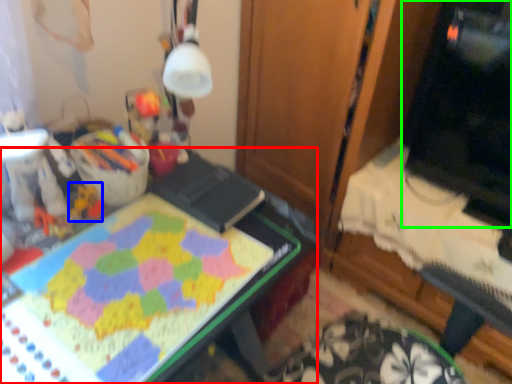
Question: Considering the real-world distances, which object is closest to desk (highlighted by a red box)? toy (highlighted by a blue box) or computer monitor (highlighted by a green box).

Choices:
 (A) toy
 (B) computer monitor

Answer: (A)